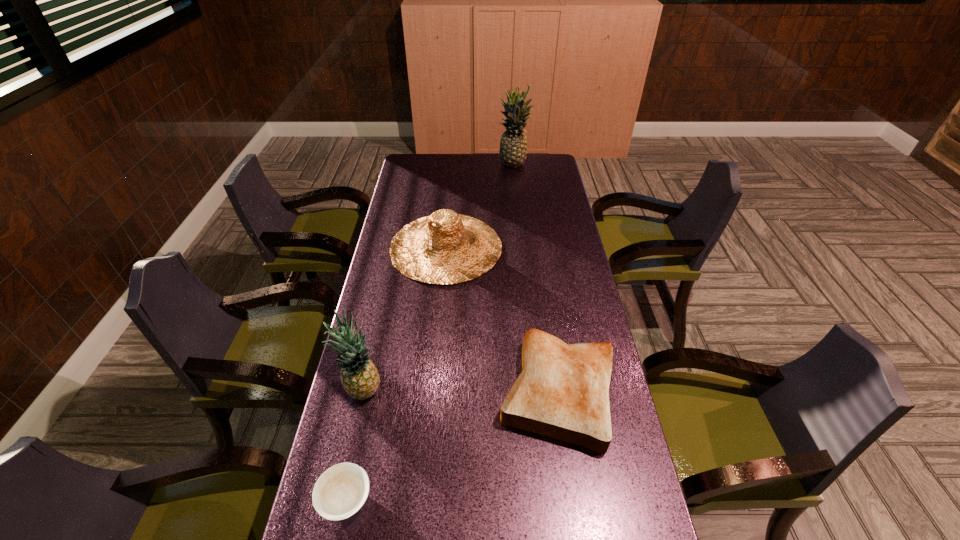
Locate an element on the screen. free point located 0.370m on the back of the shorter pineapple is located at coordinates (387, 285).

Where is `free spot located on the back of the fourth nearest object`? This screenshot has width=960, height=540. free spot located on the back of the fourth nearest object is located at coordinates (451, 186).

Image resolution: width=960 pixels, height=540 pixels. Find the location of `free region located 0.170m on the back of the bread`. free region located 0.170m on the back of the bread is located at coordinates pos(544,301).

Image resolution: width=960 pixels, height=540 pixels. What are the coordinates of `free point located 0.300m on the right of the nearest object` in the screenshot? It's located at (501, 499).

Identify the location of object positioned at the far edge. (513, 146).

In order to click on pineapple that is at the left edge in this screenshot , I will do `click(360, 379)`.

The height and width of the screenshot is (540, 960). What are the coordinates of `sunhat that is at the left edge` in the screenshot? It's located at (444, 248).

What are the coordinates of `bowl located at the left edge` in the screenshot? It's located at coord(341,490).

Image resolution: width=960 pixels, height=540 pixels. I want to click on pineapple present at the right edge, so click(513, 146).

The height and width of the screenshot is (540, 960). I want to click on bread at the right edge, so click(562, 392).